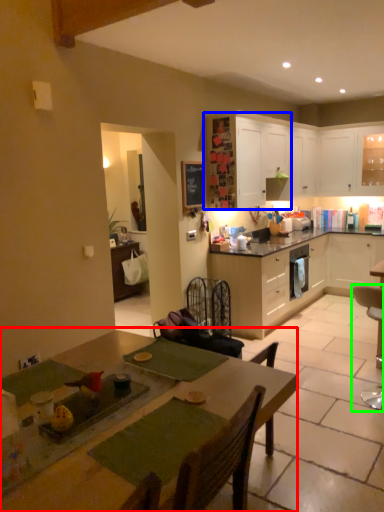
Question: Which is farther away from table (highlighted by a red box)? cabinetry (highlighted by a blue box) or chair (highlighted by a green box)?

Choices:
 (A) cabinetry
 (B) chair

Answer: (A)